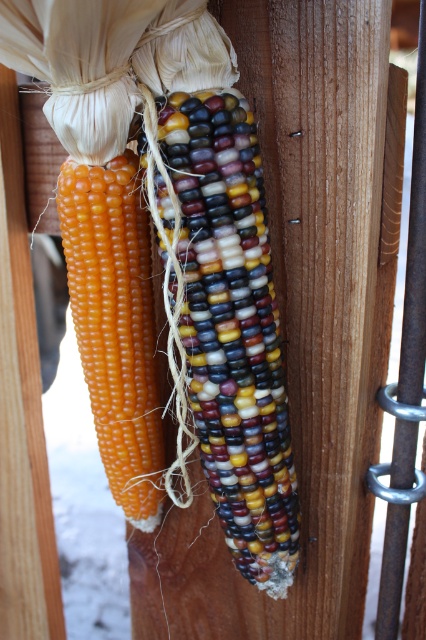
You are an artist wanting to paint both the multicolored polished corn at center and the smooth yellow corn at left. Which corn has a bigger size?

The multicolored polished corn at center has a larger size compared to the smooth yellow corn at left.

You are a farmer checking the corn display. You notice a specific point marked at coordinates point (230, 326). Which corn is this point located on?

The point (230, 326) is on the multicolored polished corn at center.